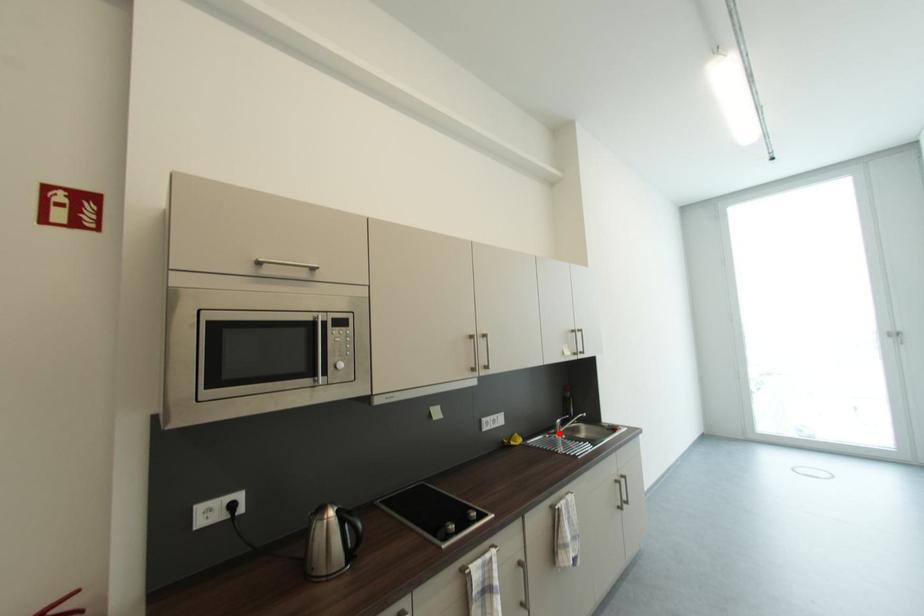
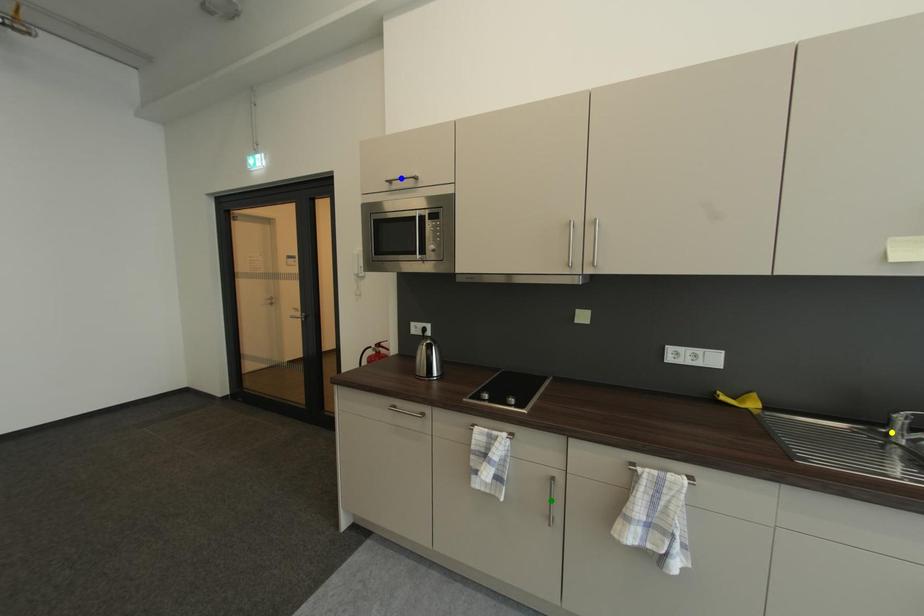
Question: I am providing you with two images of the same scene from different viewpoints. A red point is marked on the first image. You are given multiple points on the second image. Which point in image 2 represents the same 3d spot as the red point in image 1?

Choices:
 (A) yellow point
 (B) green point
 (C) blue point

Answer: (A)